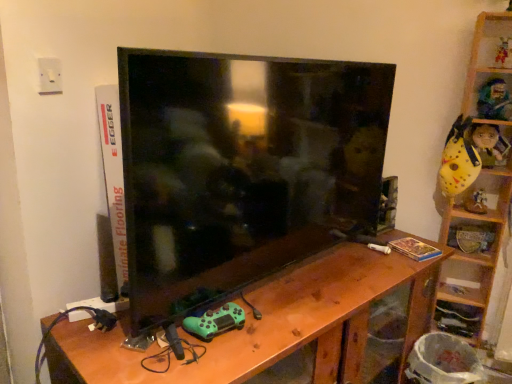
Find the location of a particular element. vacant space that is in between matte black tv at center and green matte controller at lower center, arranged as the 5th toy when viewed from the right is located at coordinates (292, 287).